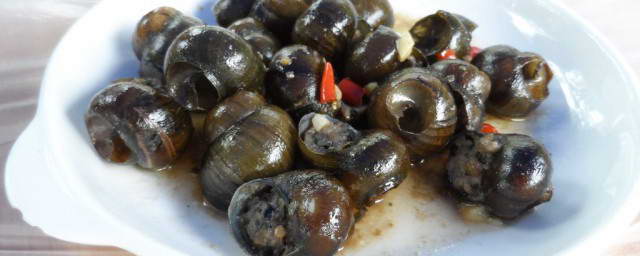
The height and width of the screenshot is (256, 640). Find the location of `bowl`. bowl is located at coordinates (580, 154).